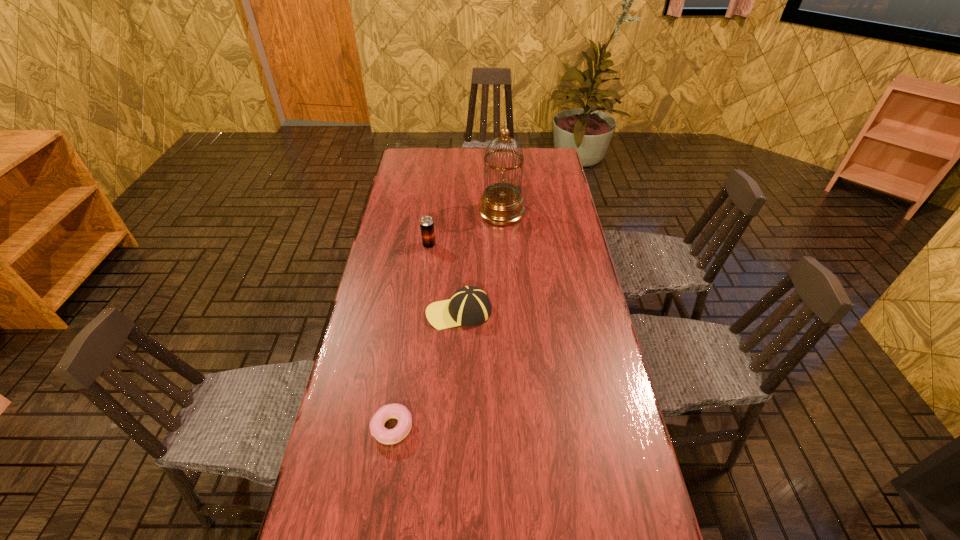
This screenshot has width=960, height=540. In order to click on free spot that satisfies the following two spatial constraints: 1. on the back side of the beer can; 2. on the right side of the doughnut in this screenshot , I will do `click(420, 245)`.